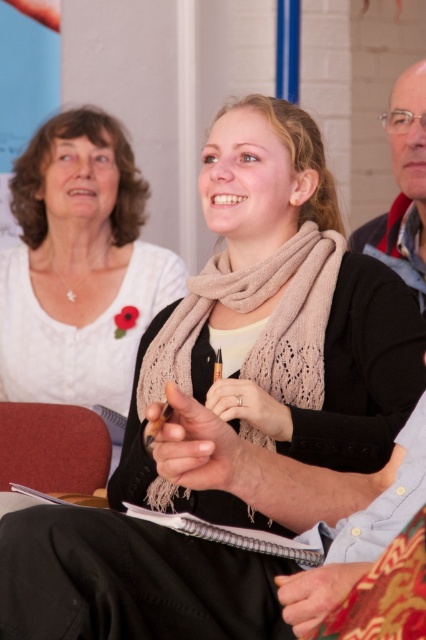
Question: Which object is positioned farthest from the knitted beige scarf at center?

Choices:
 (A) white knitted scarf at upper center
 (B) matte black sweater at upper right

Answer: (A)

Question: Considering the relative positions of white knitted scarf at upper center and knitted beige scarf at center in the image provided, where is white knitted scarf at upper center located with respect to knitted beige scarf at center?

Choices:
 (A) right
 (B) left

Answer: (B)

Question: Which of the following is the closest to the observer?

Choices:
 (A) (5, 461)
 (B) (307, 250)

Answer: (B)

Question: Is white knitted scarf at upper center further to camera compared to matte black sweater at upper right?

Choices:
 (A) yes
 (B) no

Answer: (A)

Question: Can you confirm if white knitted scarf at upper center is wider than knitted beige scarf at center?

Choices:
 (A) yes
 (B) no

Answer: (A)

Question: Which point is closer to the camera?

Choices:
 (A) (290, 342)
 (B) (400, 179)
 (C) (71, 134)

Answer: (A)